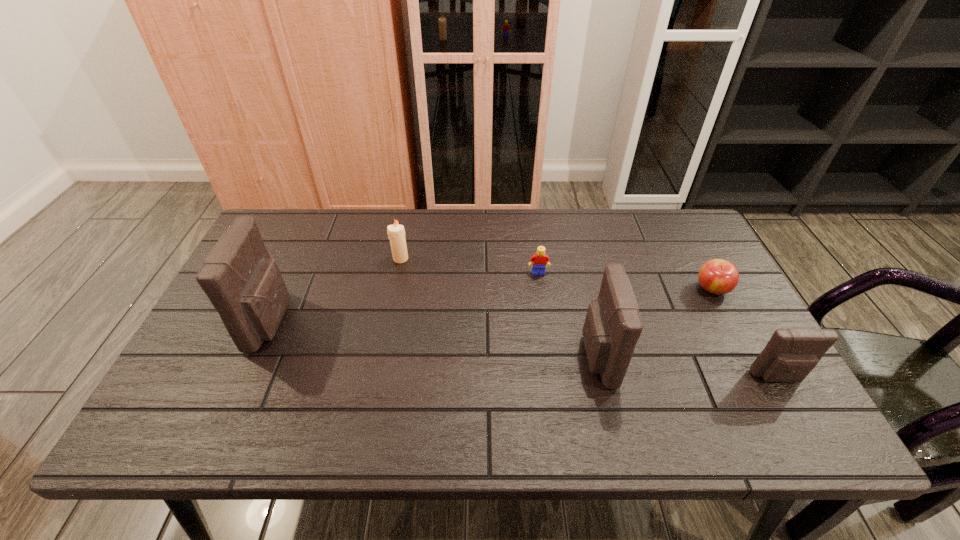
The height and width of the screenshot is (540, 960). Find the location of `the leftmost object`. the leftmost object is located at coordinates (245, 286).

Image resolution: width=960 pixels, height=540 pixels. Find the location of `the fourth object from left to right`. the fourth object from left to right is located at coordinates (612, 327).

At what (x,y) coordinates should I click in order to perform the action: click on the second pouch from left to right. Please return your answer as a coordinate pair (x, y). The image size is (960, 540). Looking at the image, I should click on (612, 327).

The height and width of the screenshot is (540, 960). I want to click on the shortest pouch, so click(791, 354).

Locate an element on the screen. the second farthest object is located at coordinates (539, 260).

Where is `the fourth object from right to left`? Image resolution: width=960 pixels, height=540 pixels. the fourth object from right to left is located at coordinates (539, 260).

Locate an element on the screen. This screenshot has height=540, width=960. apple is located at coordinates (717, 276).

The width and height of the screenshot is (960, 540). What are the coordinates of `the fifth object from right to left` in the screenshot? It's located at (396, 233).

Image resolution: width=960 pixels, height=540 pixels. In order to click on the farthest object in this screenshot , I will do `click(396, 233)`.

I want to click on vacant position located 0.370m with an open flap on the leftmost object, so click(432, 321).